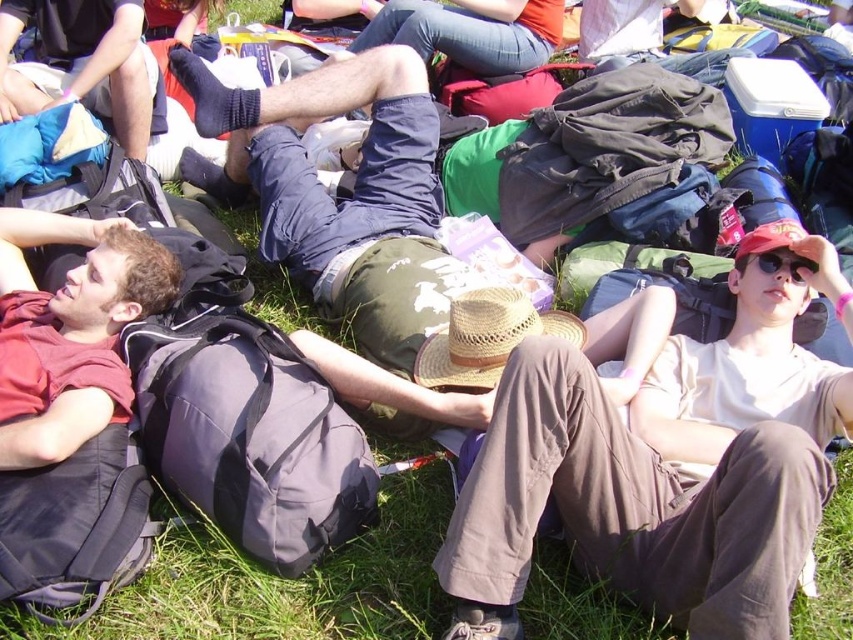
What are the coordinates of the matte red shirt at left?

The coordinates of the matte red shirt at left are at point (x=70, y=330).

You are planning to place a small picnic basket between the matte red shirt at left and the matte black sunglasses at center right. Based on their positions, which object should the basket be closer to?

The matte red shirt at left is wider than the matte black sunglasses at center right, so the basket should be placed closer to the matte red shirt at left to ensure it fits within the space between them.